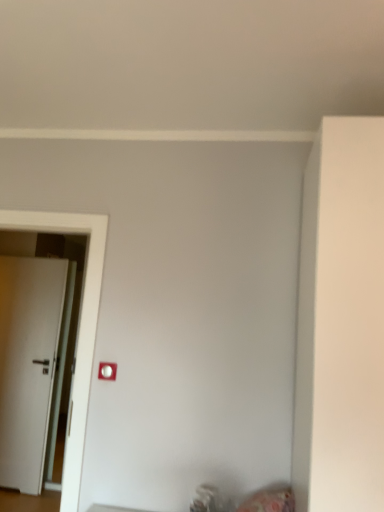
Find the location of `white matte door at left`. white matte door at left is located at coordinates (28, 364).

In order to face white matte door at left, should I rotate leftwards or rightwards?

You should look left and rotate roughly 22.169 degrees.

The image size is (384, 512). Describe the element at coordinates (28, 364) in the screenshot. I see `white matte door at left` at that location.

The image size is (384, 512). I want to click on white plastic light switch at center, so click(x=107, y=371).

The height and width of the screenshot is (512, 384). What do you see at coordinates (107, 371) in the screenshot?
I see `white plastic light switch at center` at bounding box center [107, 371].

Identify the location of white matte door at left. (28, 364).

Is white plastic light switch at center to the left or to the right of white matte door at left in the image?

Clearly, white plastic light switch at center is on the right of white matte door at left in the image.

Relative to white matte door at left, is white plastic light switch at center in front or behind?

white plastic light switch at center is in front of white matte door at left.

Between point (114, 380) and point (54, 449), which one is positioned in front?

The point (114, 380) is more forward.

From the image's perspective, is white plastic light switch at center on top of white matte door at left?

→ Yes, from the image's perspective, white plastic light switch at center is on top of white matte door at left.

From a real-world perspective, which object stands above the other?

white plastic light switch at center is physically above.

Is white plastic light switch at center thinner than white matte door at left?

Correct, the width of white plastic light switch at center is less than that of white matte door at left.

Is white plastic light switch at center taller or shorter than white matte door at left?

Clearly, white plastic light switch at center is shorter compared to white matte door at left.

Considering the relative sizes of white plastic light switch at center and white matte door at left in the image provided, is white plastic light switch at center bigger than white matte door at left?

Actually, white plastic light switch at center might be smaller than white matte door at left.

Is white plastic light switch at center situated inside white matte door at left or outside?

white plastic light switch at center exists outside the volume of white matte door at left.

Is white plastic light switch at center touching white matte door at left?

They are not placed beside each other.

Could you tell me if white plastic light switch at center is turned towards white matte door at left?

No, white plastic light switch at center is not turned towards white matte door at left.

Measure the distance between white plastic light switch at center and white matte door at left.

white plastic light switch at center is 6.84 feet away from white matte door at left.

The width and height of the screenshot is (384, 512). In order to click on door that is under the white plastic light switch at center (from a real-world perspective) in this screenshot , I will do `click(28, 364)`.

Which object is positioned more to the left, white matte door at left or white plastic light switch at center?

white matte door at left.

Between white matte door at left and white plastic light switch at center, which one is positioned behind?

white matte door at left is behind.

Is point (22, 395) positioned in front of point (101, 362)?

No, it is not.

From the image's perspective, is white matte door at left located beneath white plastic light switch at center?

Yes, from the image's perspective, white matte door at left is below white plastic light switch at center.

From a real-world perspective, is white matte door at left positioned above or below white plastic light switch at center?

Clearly, from a real-world perspective, white matte door at left is below white plastic light switch at center.

Considering the relative sizes of white matte door at left and white plastic light switch at center in the image provided, is white matte door at left thinner than white plastic light switch at center?

No.

Considering the relative sizes of white matte door at left and white plastic light switch at center in the image provided, is white matte door at left shorter than white plastic light switch at center?

Incorrect, the height of white matte door at left does not fall short of that of white plastic light switch at center.

Which of these two, white matte door at left or white plastic light switch at center, is bigger?

white matte door at left is bigger.

Which is correct: white matte door at left is inside white plastic light switch at center, or outside of it?

white matte door at left lies outside white plastic light switch at center.

Is there a large distance between white matte door at left and white plastic light switch at center?

That's right, there is a large distance between white matte door at left and white plastic light switch at center.

Is white matte door at left oriented away from white plastic light switch at center?

No, white matte door at left's orientation is not away from white plastic light switch at center.

What's the angular difference between white matte door at left and white plastic light switch at center's facing directions?

They differ by 0.455 degrees in their facing directions.

You are a GUI agent. You are given a task and a screenshot of the screen. Output one action in this format:
    pyautogui.click(x=<x>, y=<y>)
    Task: Click on the door lying below the white plastic light switch at center (from the image's perspective)
    
    Given the screenshot: What is the action you would take?
    pyautogui.click(x=28, y=364)

Locate an element on the screen. The image size is (384, 512). light switch above the white matte door at left (from the image's perspective) is located at coordinates [x=107, y=371].

Find the location of a particular element. door located on the left of white plastic light switch at center is located at coordinates (28, 364).